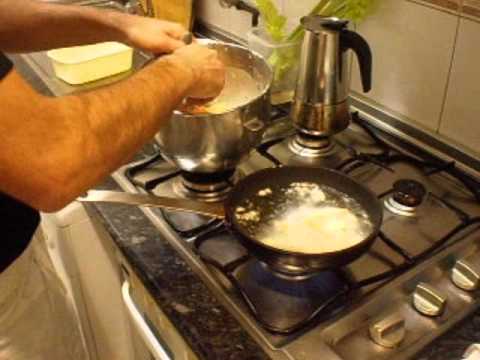
Find the location of a particular element. jug is located at coordinates (321, 49).